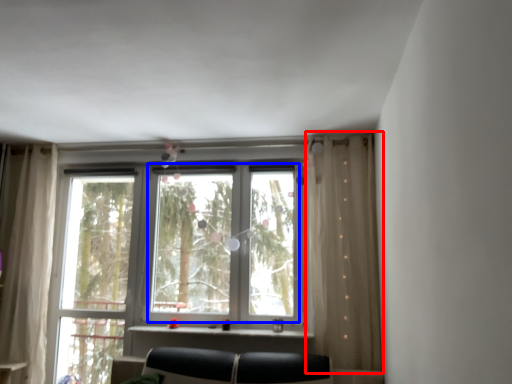
Question: Among these objects, which one is nearest to the camera, curtain (highlighted by a red box) or bay window (highlighted by a blue box)?

Choices:
 (A) curtain
 (B) bay window

Answer: (A)